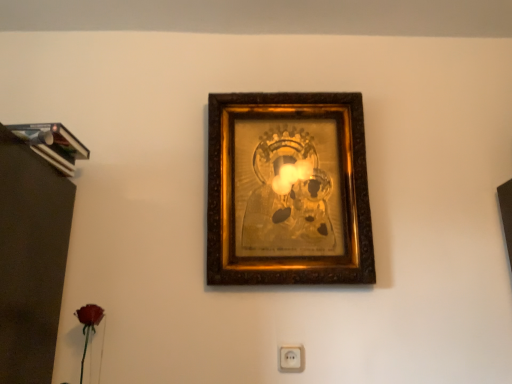
Question: Does gold ornate frame at center turn towards white plastic/socket at lower center?

Choices:
 (A) no
 (B) yes

Answer: (A)

Question: Can you confirm if gold ornate frame at center is smaller than white plastic/socket at lower center?

Choices:
 (A) no
 (B) yes

Answer: (A)

Question: Can you confirm if gold ornate frame at center is bigger than white plastic/socket at lower center?

Choices:
 (A) yes
 (B) no

Answer: (A)

Question: From the image's perspective, would you say gold ornate frame at center is positioned over white plastic/socket at lower center?

Choices:
 (A) no
 (B) yes

Answer: (B)

Question: Is gold ornate frame at center surrounding white plastic/socket at lower center?

Choices:
 (A) no
 (B) yes

Answer: (A)

Question: Can you confirm if gold ornate frame at center is positioned to the right of white plastic/socket at lower center?

Choices:
 (A) no
 (B) yes

Answer: (B)

Question: From the image's perspective, is white plastic/socket at lower center located above gold ornate frame at center?

Choices:
 (A) yes
 (B) no

Answer: (B)

Question: Can you confirm if white plastic/socket at lower center is positioned to the right of gold ornate frame at center?

Choices:
 (A) no
 (B) yes

Answer: (A)

Question: Considering the relative sizes of white plastic/socket at lower center and gold ornate frame at center in the image provided, is white plastic/socket at lower center smaller than gold ornate frame at center?

Choices:
 (A) yes
 (B) no

Answer: (A)

Question: Considering the relative sizes of white plastic/socket at lower center and gold ornate frame at center in the image provided, is white plastic/socket at lower center thinner than gold ornate frame at center?

Choices:
 (A) no
 (B) yes

Answer: (B)

Question: Would you say gold ornate frame at center is part of white plastic/socket at lower center's contents?

Choices:
 (A) no
 (B) yes

Answer: (A)

Question: Considering the relative sizes of white plastic/socket at lower center and gold ornate frame at center in the image provided, is white plastic/socket at lower center wider than gold ornate frame at center?

Choices:
 (A) yes
 (B) no

Answer: (B)

Question: In the image, is gold ornate frame at center positioned in front of or behind white plastic/socket at lower center?

Choices:
 (A) front
 (B) behind

Answer: (A)